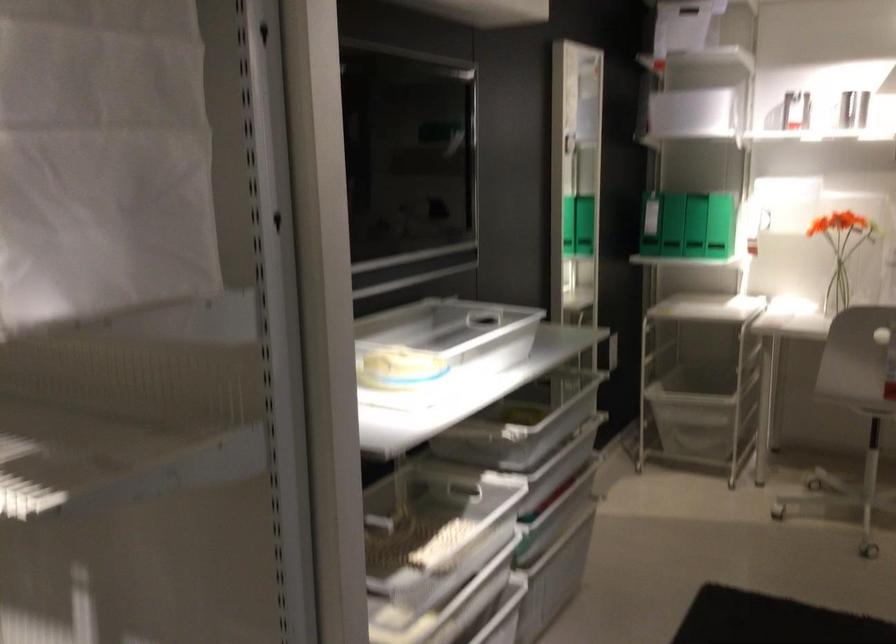
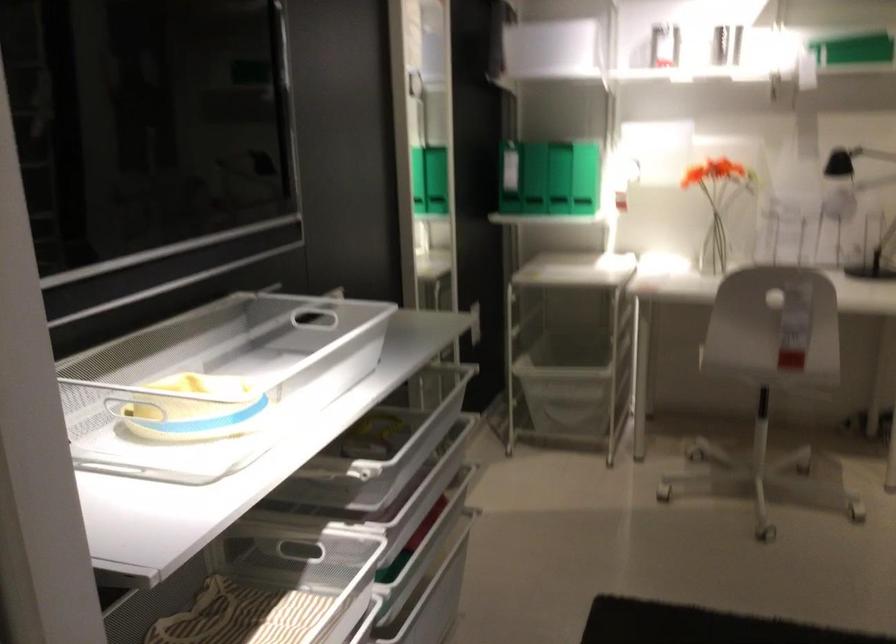
Locate, in the second image, the point that corresponds to point 677,209 in the first image.

(511, 174)